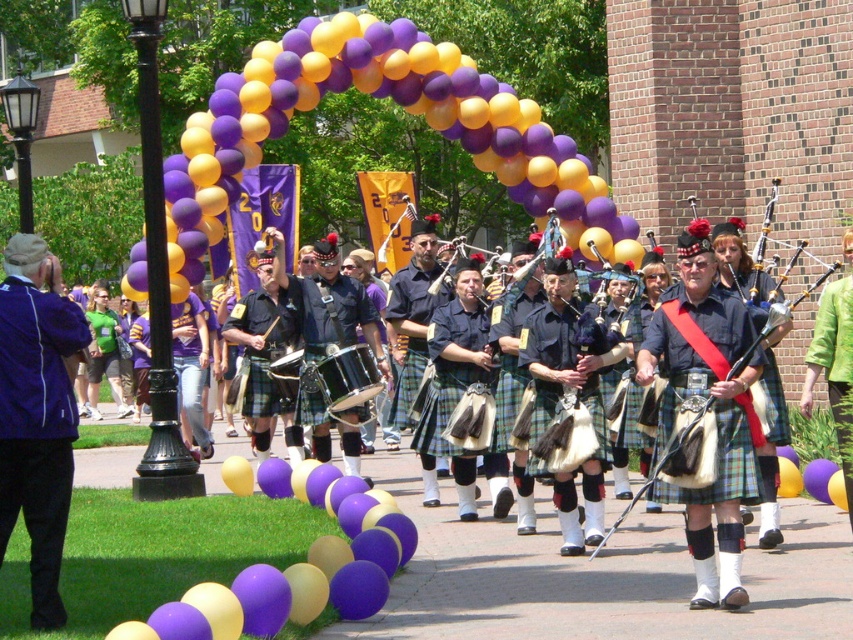
Which is more to the right, shiny black drum at center or plaid fabric kilt at center?

plaid fabric kilt at center is more to the right.

Who is positioned more to the left, shiny black drum at center or plaid fabric kilt at center?

Positioned to the left is shiny black drum at center.

At what (x,y) coordinates should I click in order to perform the action: click on shiny black drum at center. Please return your answer as a coordinate pair (x, y). Looking at the image, I should click on (334, 342).

Identify the location of shiny black drum at center. [334, 342].

Does purple fabric jacket at left come in front of shiny black drum at center?

Yes, it is.

Image resolution: width=853 pixels, height=640 pixels. Find the location of `purple fabric jacket at left`. purple fabric jacket at left is located at coordinates (38, 413).

At what (x,y) coordinates should I click in order to perform the action: click on purple fabric jacket at left. Please return your answer as a coordinate pair (x, y). The image size is (853, 640). Looking at the image, I should click on (38, 413).

Which is behind, point (7, 246) or point (767, 458)?

Positioned behind is point (767, 458).

Locate an element on the screen. Image resolution: width=853 pixels, height=640 pixels. purple fabric jacket at left is located at coordinates (38, 413).